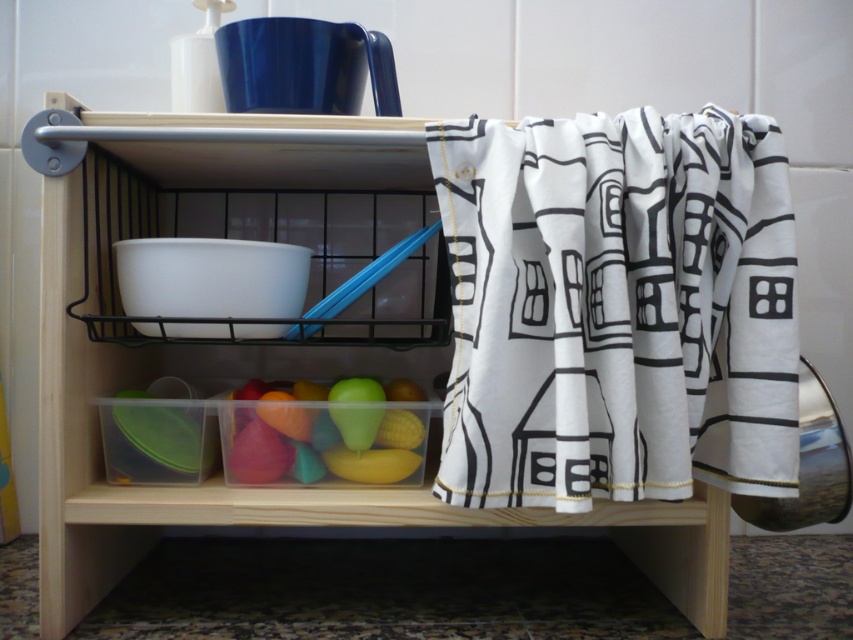
Question: Which object appears farthest from the camera in this image?

Choices:
 (A) white fabric at right
 (B) transparent plastic container at lower center

Answer: (B)

Question: Can you confirm if white fabric at right is bigger than transparent plastic container at lower center?

Choices:
 (A) no
 (B) yes

Answer: (A)

Question: Is white fabric at right to the left of transparent plastic container at lower center from the viewer's perspective?

Choices:
 (A) no
 (B) yes

Answer: (A)

Question: Can you confirm if white fabric at right is positioned above transparent plastic container at lower center?

Choices:
 (A) no
 (B) yes

Answer: (B)

Question: Which point is closer to the camera?

Choices:
 (A) (741, 378)
 (B) (138, 122)

Answer: (A)

Question: Which point is closer to the camera taking this photo?

Choices:
 (A) (546, 451)
 (B) (70, 444)

Answer: (A)